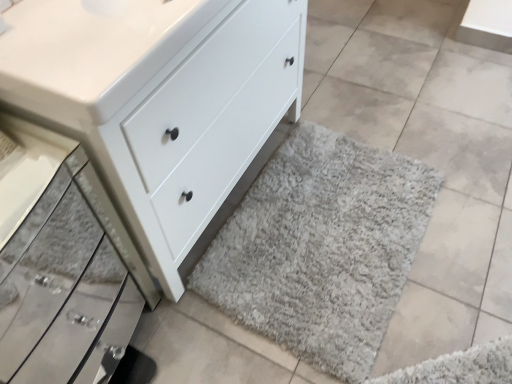
Question: Can you confirm if white glossy sink at upper left is positioned to the left of gray shaggy rug at lower right?

Choices:
 (A) yes
 (B) no

Answer: (A)

Question: Is white glossy sink at upper left thinner than gray shaggy rug at lower right?

Choices:
 (A) yes
 (B) no

Answer: (A)

Question: Is white glossy sink at upper left positioned behind gray shaggy rug at lower right?

Choices:
 (A) yes
 (B) no

Answer: (B)

Question: Is white glossy sink at upper left not within gray shaggy rug at lower right?

Choices:
 (A) yes
 (B) no

Answer: (A)

Question: Is white glossy sink at upper left turned away from gray shaggy rug at lower right?

Choices:
 (A) yes
 (B) no

Answer: (B)

Question: Considering the relative positions of satin silver drawer at lower left and white glossy sink at upper left in the image provided, is satin silver drawer at lower left to the left or to the right of white glossy sink at upper left?

Choices:
 (A) left
 (B) right

Answer: (A)

Question: Is satin silver drawer at lower left inside or outside of white glossy sink at upper left?

Choices:
 (A) inside
 (B) outside

Answer: (B)

Question: Is satin silver drawer at lower left taller or shorter than white glossy sink at upper left?

Choices:
 (A) short
 (B) tall

Answer: (B)

Question: From the image's perspective, is satin silver drawer at lower left positioned above or below white glossy sink at upper left?

Choices:
 (A) above
 (B) below

Answer: (B)

Question: Is white glossy sink at upper left situated inside white matte chest of drawers at lower center or outside?

Choices:
 (A) inside
 (B) outside

Answer: (A)

Question: Is white glossy sink at upper left wider or thinner than white matte chest of drawers at lower center?

Choices:
 (A) thin
 (B) wide

Answer: (A)

Question: From the image's perspective, is white glossy sink at upper left positioned above or below white matte chest of drawers at lower center?

Choices:
 (A) below
 (B) above

Answer: (B)

Question: Considering the positions of white glossy sink at upper left and white matte chest of drawers at lower center in the image, is white glossy sink at upper left taller or shorter than white matte chest of drawers at lower center?

Choices:
 (A) tall
 (B) short

Answer: (B)

Question: From the image's perspective, is white matte chest of drawers at lower center above or below white glossy sink at upper left?

Choices:
 (A) above
 (B) below

Answer: (B)

Question: From a real-world perspective, relative to white glossy sink at upper left, is white matte chest of drawers at lower center vertically above or below?

Choices:
 (A) above
 (B) below

Answer: (B)